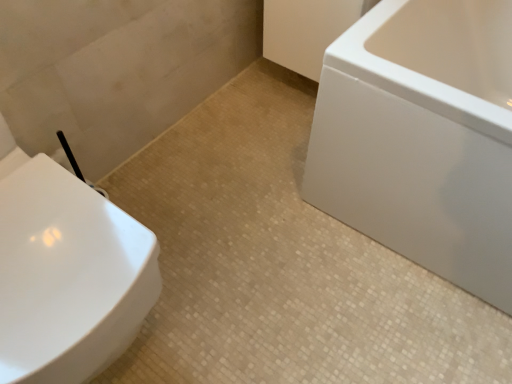
Find the location of a particular element. vacant space that is to the left of white glossy bathtub at right is located at coordinates (252, 196).